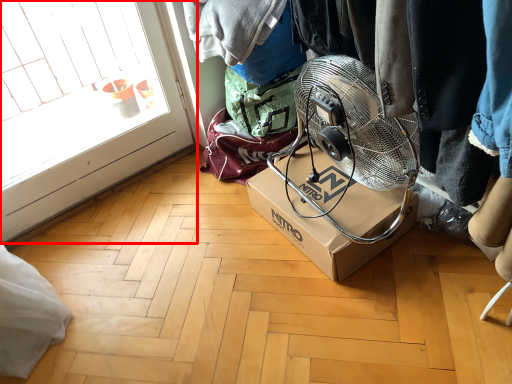
Question: In this image, where is glass door (annotated by the red box) located relative to box?

Choices:
 (A) right
 (B) left

Answer: (B)